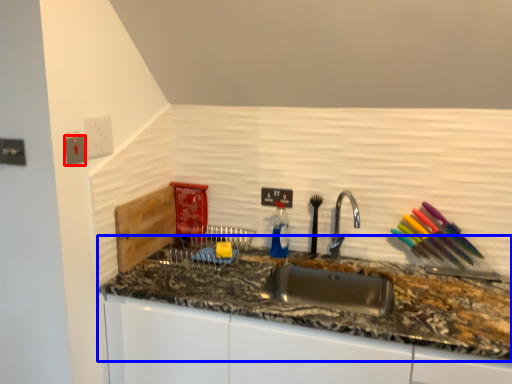
Question: Which object appears farthest to the camera in this image, electric outlet (highlighted by a red box) or countertop (highlighted by a blue box)?

Choices:
 (A) electric outlet
 (B) countertop

Answer: (A)